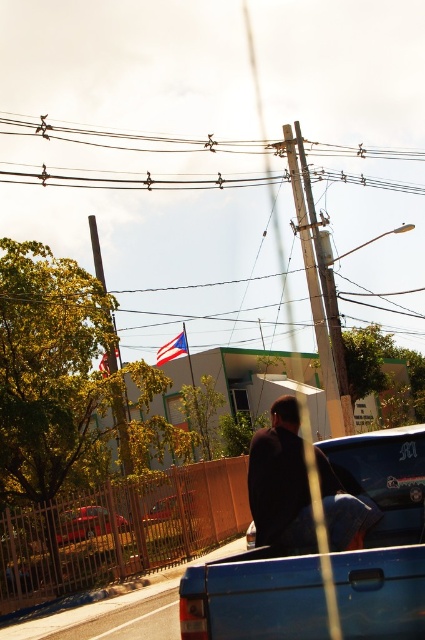
Question: Does brown wooden fence at lower left come behind red fabric flag at upper center?

Choices:
 (A) no
 (B) yes

Answer: (A)

Question: Can you confirm if blue matte truck at center is positioned to the right of wooden utility pole at center?

Choices:
 (A) no
 (B) yes

Answer: (A)

Question: Considering the real-world distances, which object is farthest from the brown wooden fence at lower left?

Choices:
 (A) blue fabric flag at upper center
 (B) metallic flagpole at upper left
 (C) metallic red car at center
 (D) blue matte truck at center

Answer: (A)

Question: Which object is closer to the camera taking this photo?

Choices:
 (A) brown wooden power line at upper center
 (B) dark blue jeans at center

Answer: (B)

Question: Considering the real-world distances, which object is closest to the brown wooden fence at lower left?

Choices:
 (A) dark blue jeans at center
 (B) metallic red car at center
 (C) wooden utility pole at center

Answer: (B)

Question: Is blue matte truck at center closer to camera compared to brown wooden fence at lower left?

Choices:
 (A) yes
 (B) no

Answer: (A)